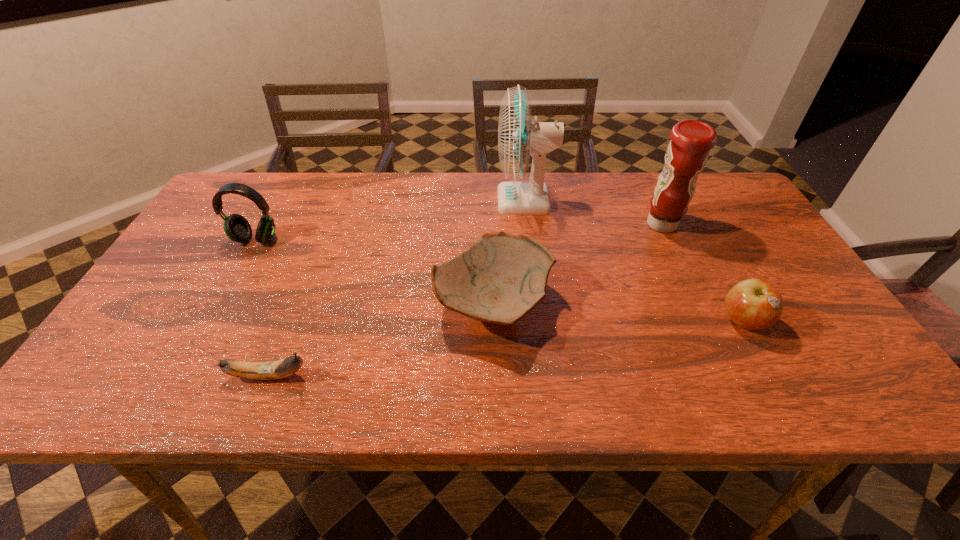
The height and width of the screenshot is (540, 960). I want to click on object that is positioned at the right edge, so click(755, 304).

In the image, there is a desktop. Where is `free space at the far edge`? This screenshot has height=540, width=960. free space at the far edge is located at coordinates (579, 215).

Find the location of `vacant area at the near edge`. vacant area at the near edge is located at coordinates (783, 376).

You are a GUI agent. You are given a task and a screenshot of the screen. Output one action in this format:
    pyautogui.click(x=<x>, y=<y>)
    Task: Click on the free space at the left edge of the desktop
    
    Given the screenshot: What is the action you would take?
    [x=173, y=357]

This screenshot has height=540, width=960. In the image, there is a desktop. What are the coordinates of `vacant area at the right edge` in the screenshot? It's located at (768, 269).

Locate an element on the screen. free space at the near left corner is located at coordinates (84, 388).

The height and width of the screenshot is (540, 960). In order to click on vacant space at the far right corner of the desktop in this screenshot , I will do `click(731, 213)`.

Find the location of a particular element. Image resolution: width=960 pixels, height=540 pixels. free spot between the second tallest object and the fan is located at coordinates (593, 212).

Locate an element on the screen. Image resolution: width=960 pixels, height=540 pixels. vacant space that's between the fan and the leftmost object is located at coordinates (391, 220).

At what (x,y) coordinates should I click in order to perform the action: click on free spot between the pottery and the fifth object from right to left. Please return your answer as a coordinate pair (x, y). The height and width of the screenshot is (540, 960). Looking at the image, I should click on (381, 340).